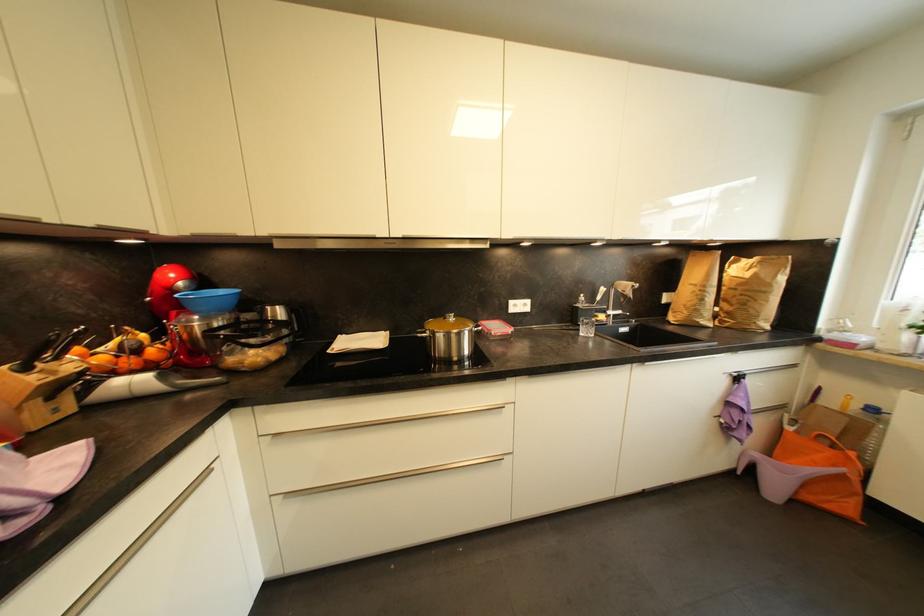
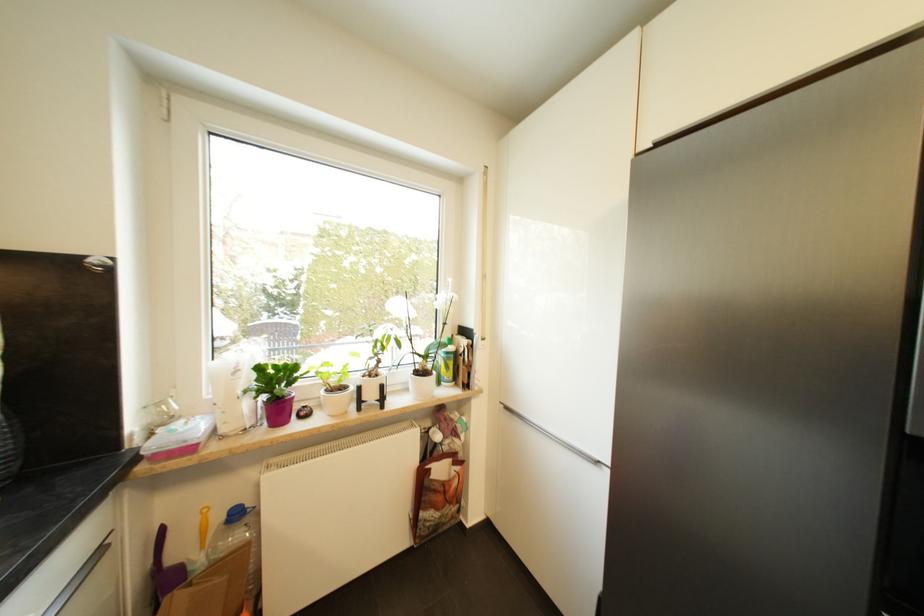
In the second image, find the point that corresponds to point (855, 347) in the first image.

(195, 451)